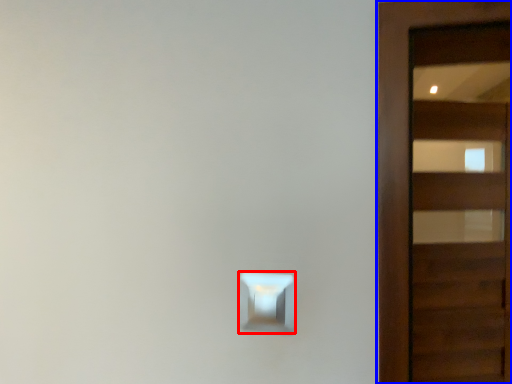
Question: Among these objects, which one is farthest to the camera, light switch (highlighted by a red box) or door (highlighted by a blue box)?

Choices:
 (A) light switch
 (B) door

Answer: (B)